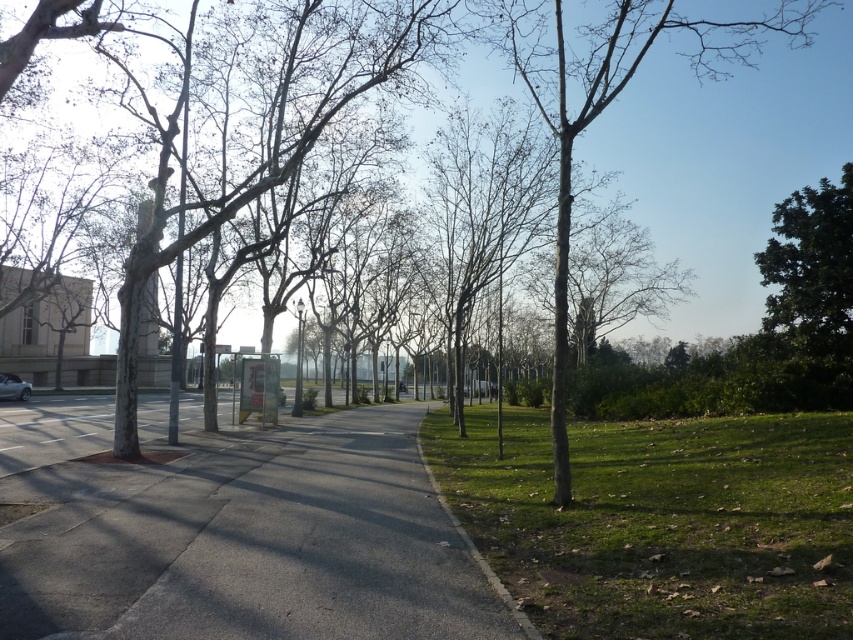
Question: Does gray concrete pavement at center have a smaller size compared to smooth bark tree at center?

Choices:
 (A) yes
 (B) no

Answer: (A)

Question: Does smooth bark tree at center have a lesser width compared to silver metallic car at lower left?

Choices:
 (A) yes
 (B) no

Answer: (B)

Question: Which point is closer to the camera?

Choices:
 (A) (776, 625)
 (B) (556, 301)
 (C) (3, 376)

Answer: (A)

Question: Considering the relative positions of gray concrete pavement at center and silver metallic car at lower left in the image provided, where is gray concrete pavement at center located with respect to silver metallic car at lower left?

Choices:
 (A) left
 (B) right

Answer: (B)

Question: Which object is closer to the camera taking this photo?

Choices:
 (A) gray concrete pavement at center
 (B) silver metallic car at lower left

Answer: (A)

Question: Among these objects, which one is farthest from the camera?

Choices:
 (A) green grass at lower right
 (B) gray concrete pavement at center
 (C) silver metallic car at lower left
 (D) smooth bark tree at center

Answer: (C)